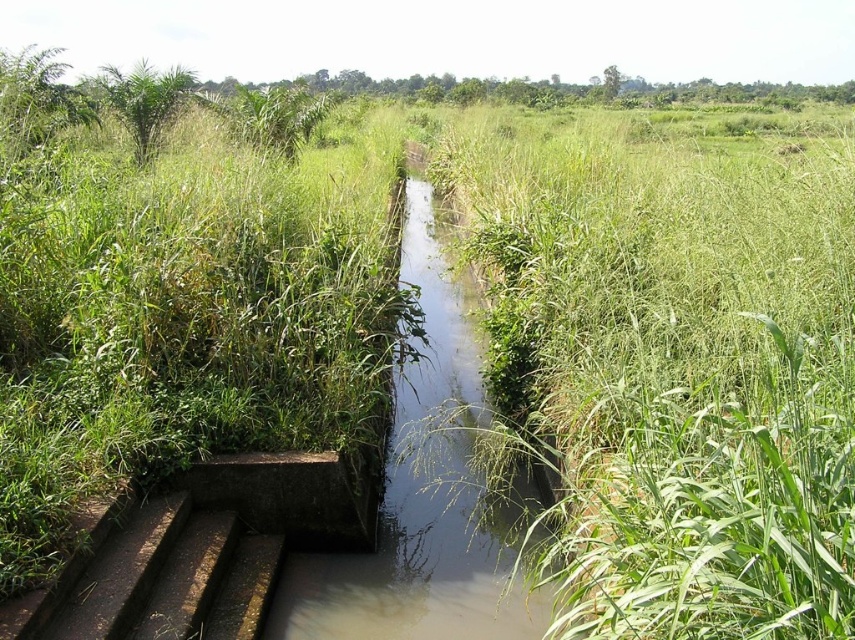
Question: Is muddy concrete stream at center smaller than rusty metal stairs at lower left?

Choices:
 (A) no
 (B) yes

Answer: (A)

Question: Which point is farther from the camera taking this photo?

Choices:
 (A) (488, 497)
 (B) (219, 593)

Answer: (A)

Question: Considering the relative positions of muddy concrete stream at center and rusty metal stairs at lower left in the image provided, where is muddy concrete stream at center located with respect to rusty metal stairs at lower left?

Choices:
 (A) right
 (B) left

Answer: (A)

Question: Which point appears closest to the camera in this image?

Choices:
 (A) click(154, 605)
 (B) click(414, 451)

Answer: (A)

Question: Which object is farther from the camera taking this photo?

Choices:
 (A) muddy concrete stream at center
 (B) rusty metal stairs at lower left

Answer: (A)

Question: Is muddy concrete stream at center below rusty metal stairs at lower left?

Choices:
 (A) yes
 (B) no

Answer: (B)